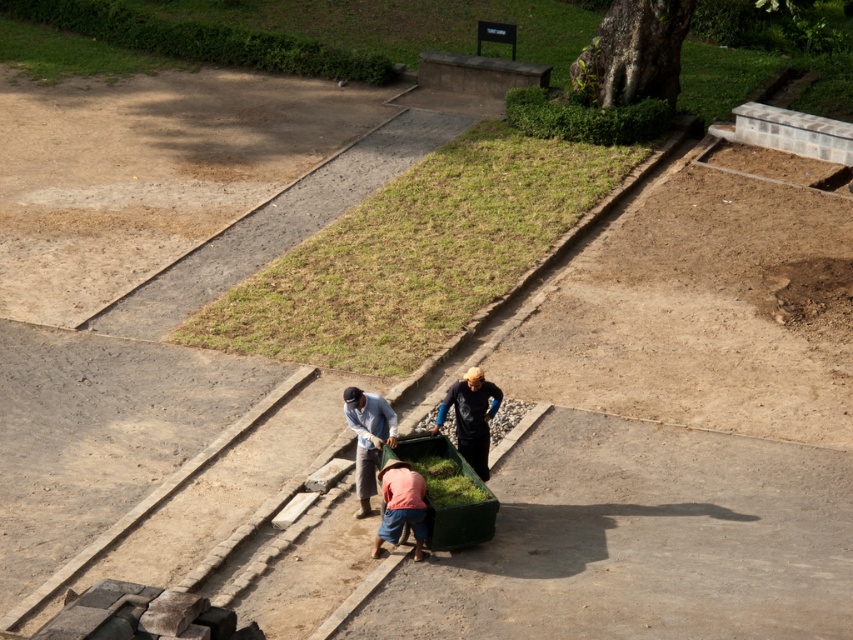
Which is behind, point (471, 452) or point (393, 502)?

Point (471, 452)

Is point (469, 378) positioned in front of point (422, 508)?

That is False.

You are a GUI agent. You are given a task and a screenshot of the screen. Output one action in this format:
    pyautogui.click(x=<x>, y=<y>)
    Task: Click on the black matte shirt at center
    The width and height of the screenshot is (853, 640).
    Given the screenshot: What is the action you would take?
    pyautogui.click(x=471, y=417)

You are a GUI agent. You are given a task and a screenshot of the screen. Output one action in this format:
    pyautogui.click(x=<x>, y=<y>)
    Task: Click on the light blue denim shirt at center
    
    Given the screenshot: What is the action you would take?
    pyautogui.click(x=368, y=438)

Which of these two, light blue denim shirt at center or orange fabric pants at center, stands shorter?

With less height is orange fabric pants at center.

Is point (347, 406) positioned behind point (390, 531)?

Yes, it is behind point (390, 531).

Identify the location of light blue denim shirt at center. The image size is (853, 640). coord(368,438).

Is point (457, 516) farther from viewer compared to point (469, 438)?

No.

Between green matte cart at center and black matte shirt at center, which one is positioned lower?

green matte cart at center is lower down.

Does point (445, 525) come farther from viewer compared to point (467, 452)?

No, it is in front of (467, 452).

Locate an element on the screen. Image resolution: width=853 pixels, height=640 pixels. green matte cart at center is located at coordinates (x=453, y=502).